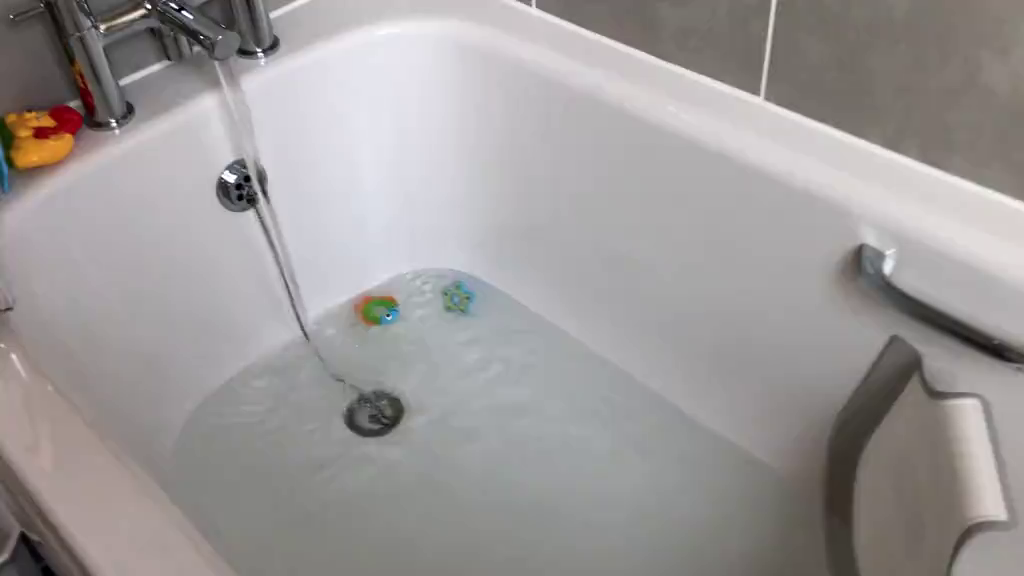
Locate an element on the screen. The height and width of the screenshot is (576, 1024). grey tiled walls is located at coordinates (884, 62).